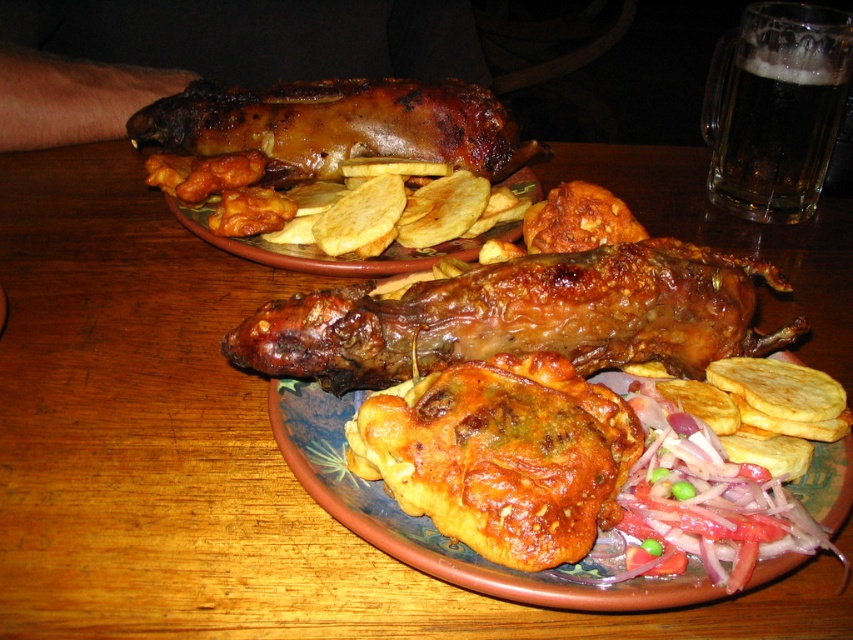
You are a photographer trying to capture a closeup of the food on the table. You notice two points of interest marked as point 1 at coordinates point (693, 316) and point 2 at coordinates point (403, 136). Which point should you focus on to ensure the closest subject is in sharp focus?

Point (693, 316) is closer to the viewer than point (403, 136), so focusing on point (693, 316) will ensure the closest subject is in sharp focus.

You are a customer at a restaurant looking at the menu. You see two dishes on the table, the brown crispy chicken wing at center and the brown crispy pork at upper center. Which dish is closer to you?

The brown crispy chicken wing at center is closer to you because it is positioned below the brown crispy pork at upper center, indicating it is in the foreground.